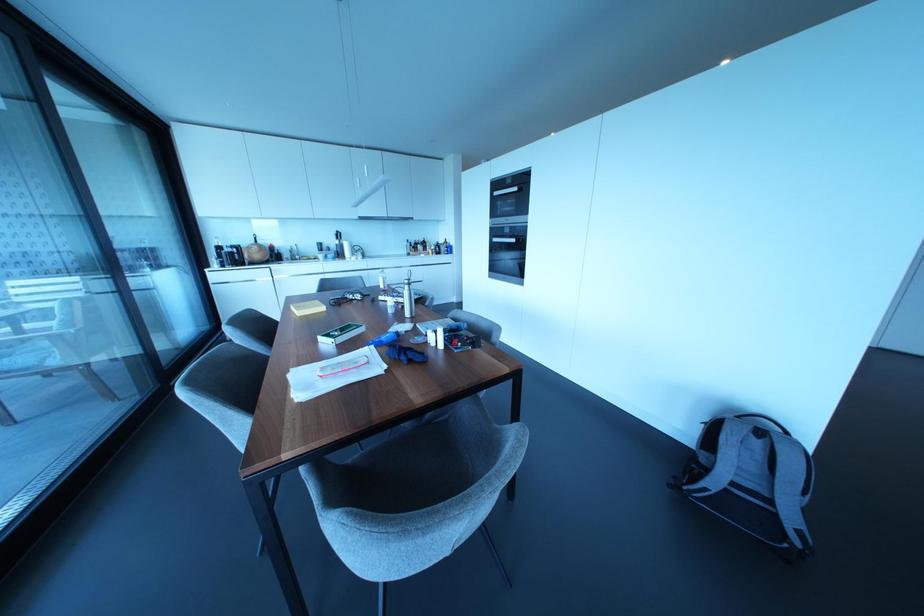
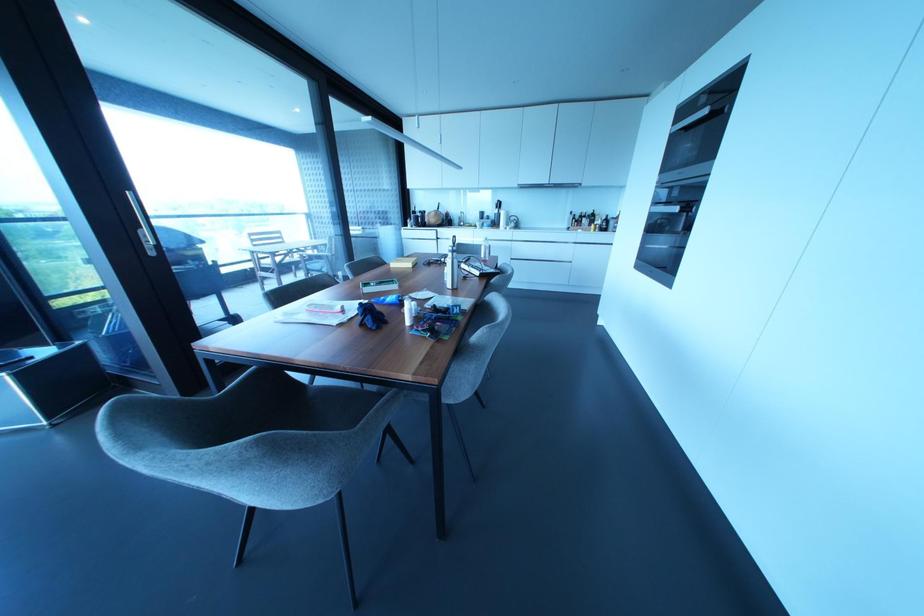
Question: The camera is either moving clockwise (left) or counter-clockwise (right) around the object. The first image is from the beginning of the video and the second image is from the end. Is the camera moving left or right when shooting the video?

Choices:
 (A) Left
 (B) Right

Answer: (B)